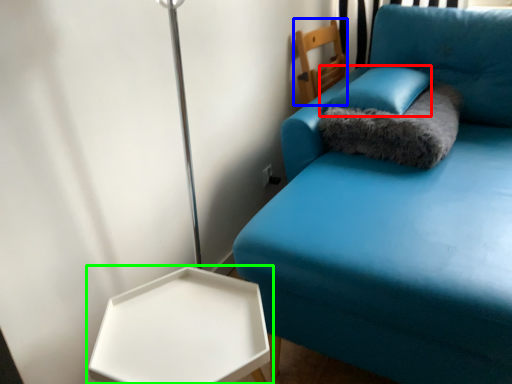
Question: Based on their relative distances, which object is farther from pillow (highlighted by a red box)? Choose from furniture (highlighted by a blue box) and table (highlighted by a green box).

Choices:
 (A) furniture
 (B) table

Answer: (B)